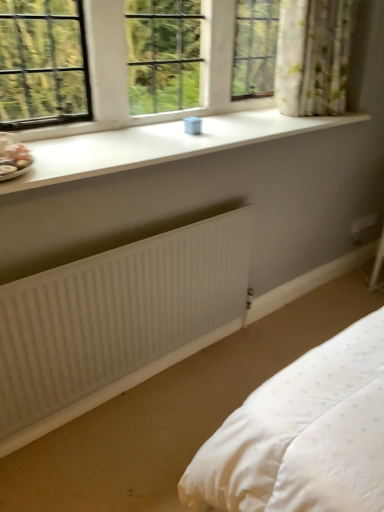
Question: Is white plastic container at upper center not near matte pink porcelain at left?

Choices:
 (A) no
 (B) yes

Answer: (A)

Question: Is matte pink porcelain at left completely or partially inside white plastic container at upper center?

Choices:
 (A) yes
 (B) no

Answer: (B)

Question: Is white plastic container at upper center shorter than matte pink porcelain at left?

Choices:
 (A) no
 (B) yes

Answer: (A)

Question: Can you confirm if white plastic container at upper center is taller than matte pink porcelain at left?

Choices:
 (A) no
 (B) yes

Answer: (B)

Question: From the image's perspective, is white plastic container at upper center located beneath matte pink porcelain at left?

Choices:
 (A) no
 (B) yes

Answer: (A)

Question: From the image's perspective, is floral fabric curtain at upper right located above or below white smooth window sill at upper center?

Choices:
 (A) above
 (B) below

Answer: (A)

Question: In the image, is floral fabric curtain at upper right on the left side or the right side of white smooth window sill at upper center?

Choices:
 (A) right
 (B) left

Answer: (A)

Question: Does point (334, 46) appear closer or farther from the camera than point (109, 156)?

Choices:
 (A) closer
 (B) farther

Answer: (B)

Question: In terms of width, does floral fabric curtain at upper right look wider or thinner when compared to white smooth window sill at upper center?

Choices:
 (A) wide
 (B) thin

Answer: (B)

Question: Which is correct: white ribbed radiator at lower center is inside floral fabric curtain at upper right, or outside of it?

Choices:
 (A) inside
 (B) outside

Answer: (B)

Question: From the image's perspective, is white ribbed radiator at lower center positioned above or below floral fabric curtain at upper right?

Choices:
 (A) above
 (B) below

Answer: (B)

Question: Relative to floral fabric curtain at upper right, is white ribbed radiator at lower center in front or behind?

Choices:
 (A) behind
 (B) front

Answer: (B)

Question: Considering the positions of white ribbed radiator at lower center and floral fabric curtain at upper right in the image, is white ribbed radiator at lower center taller or shorter than floral fabric curtain at upper right?

Choices:
 (A) tall
 (B) short

Answer: (A)

Question: Is floral fabric curtain at upper right to the left or to the right of white plastic container at upper center in the image?

Choices:
 (A) right
 (B) left

Answer: (A)

Question: Is point (281, 25) positioned closer to the camera than point (94, 94)?

Choices:
 (A) farther
 (B) closer

Answer: (A)